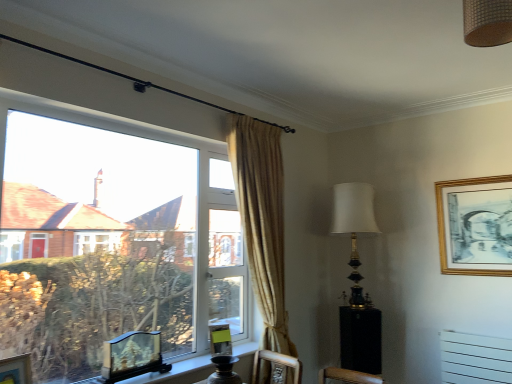
Question: Is wooden carved picture frame at window, the 3th picture frame in the back-to-front sequence, in front of or behind matte green picture frame at lower center, marked as the 2th picture frame in a right-to-left arrangement, in the image?

Choices:
 (A) front
 (B) behind

Answer: (A)

Question: Looking at their shapes, would you say wooden carved picture frame at window, the 2th picture frame in the left-to-right sequence, is wider or thinner than matte green picture frame at lower center, which is counted as the third picture frame, starting from the left?

Choices:
 (A) thin
 (B) wide

Answer: (B)

Question: Which is farther from the gold/gilded picture frame at upper right, placed as the first picture frame when sorted from top to bottom?

Choices:
 (A) black glossy side table at lower right
 (B) brown woven lampshade at upper right
 (C) gold metallic table lamp at upper right
 (D) wooden carved picture frame at window, the 2th picture frame in the left-to-right sequence
 (E) clear glass window at left

Answer: (D)

Question: Which of these objects is positioned farthest from the black glossy side table at lower right?

Choices:
 (A) clear glass window at left
 (B) gold/gilded picture frame at upper right, which is counted as the fourth picture frame, starting from the left
 (C) wooden picture frame at lower left, which is counted as the second picture frame, starting from the top
 (D) gold metallic table lamp at upper right
 (E) brown woven lampshade at upper right

Answer: (E)